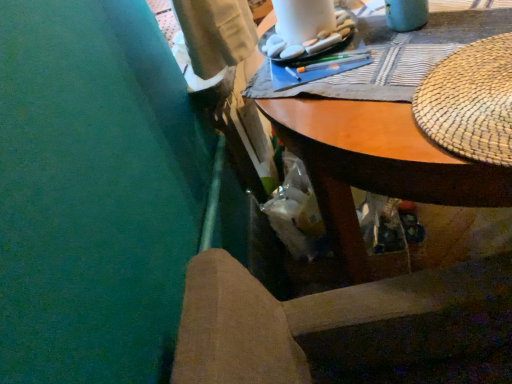
The width and height of the screenshot is (512, 384). Find the location of `free point below woven straw placemat at upper right (from a real-world perspective)`. free point below woven straw placemat at upper right (from a real-world perspective) is located at coordinates (475, 86).